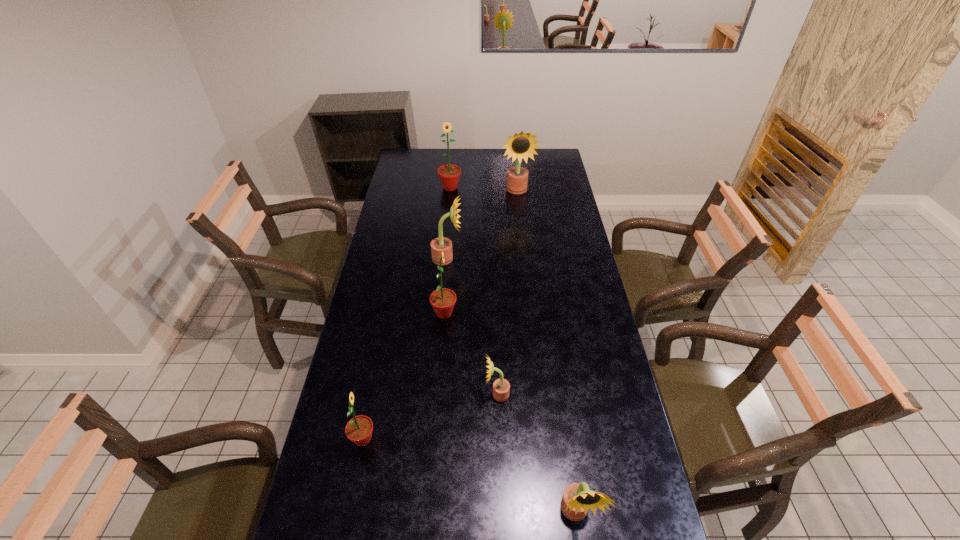
Where is `object present at the left edge`? The width and height of the screenshot is (960, 540). object present at the left edge is located at coordinates (359, 429).

Locate an element on the screen. Image resolution: width=960 pixels, height=540 pixels. object that is positioned at the right edge is located at coordinates (577, 498).

At what (x,y) coordinates should I click in order to perform the action: click on vacant region at the far edge of the desktop. Please return your answer as a coordinate pair (x, y). This screenshot has width=960, height=540. Looking at the image, I should click on (432, 155).

Identify the location of free region at the left edge of the desktop. (336, 466).

Identify the location of vacant space that is in between the nearest yellow sunflower and the farthest yellow sunflower. (546, 352).

I want to click on vacant area between the third farthest object and the biggest green sunflower, so click(x=448, y=223).

At what (x,y) coordinates should I click in order to perform the action: click on free area in between the third farthest yellow sunflower and the farthest yellow sunflower. Please return your answer as a coordinate pair (x, y). Image resolution: width=960 pixels, height=540 pixels. Looking at the image, I should click on (507, 293).

In order to click on vacant point located between the fourth nearest object and the shortest sunflower in this screenshot , I will do `click(470, 354)`.

Where is `empty location between the biggest green sunflower and the nearest green sunflower`? The image size is (960, 540). empty location between the biggest green sunflower and the nearest green sunflower is located at coordinates (407, 313).

Identify the location of free space between the third yellow sunflower from right to left and the leftmost yellow sunflower. This screenshot has height=540, width=960. (472, 326).